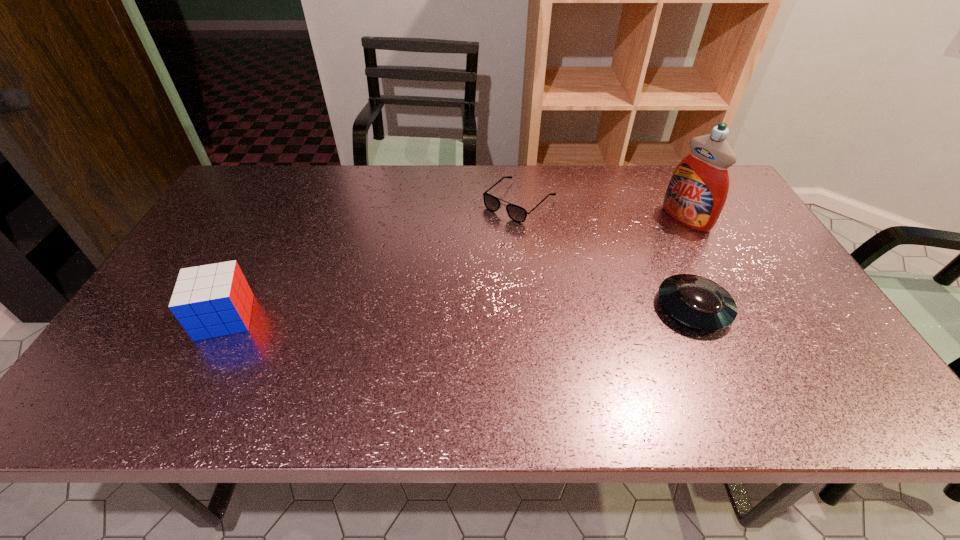
The image size is (960, 540). I want to click on vacant space located 0.280m on the front surface of the tallest object, so click(609, 265).

You are a GUI agent. You are given a task and a screenshot of the screen. Output one action in this format:
    pyautogui.click(x=<x>, y=<y>)
    Task: Click on the free space located on the front surface of the tallest object
    The height and width of the screenshot is (540, 960).
    Given the screenshot: What is the action you would take?
    pyautogui.click(x=600, y=270)

Identify the location of vacant position located 0.220m on the front surface of the tallest object. (623, 256).

This screenshot has width=960, height=540. Find the location of `spectacles at the far edge`. spectacles at the far edge is located at coordinates (518, 214).

This screenshot has width=960, height=540. What are the coordinates of `detergent that is at the far edge` in the screenshot? It's located at (696, 194).

This screenshot has width=960, height=540. What are the coordinates of `object situated at the near edge` in the screenshot? It's located at 213,300.

This screenshot has width=960, height=540. Find the location of `object present at the left edge`. object present at the left edge is located at coordinates (213, 300).

The width and height of the screenshot is (960, 540). Find the location of `object at the right edge`. object at the right edge is located at coordinates (696, 194).

Locate an element on the screen. Image resolution: width=960 pixels, height=540 pixels. object present at the near left corner is located at coordinates (213, 300).

This screenshot has width=960, height=540. Identify the location of object that is at the far right corner. (696, 194).